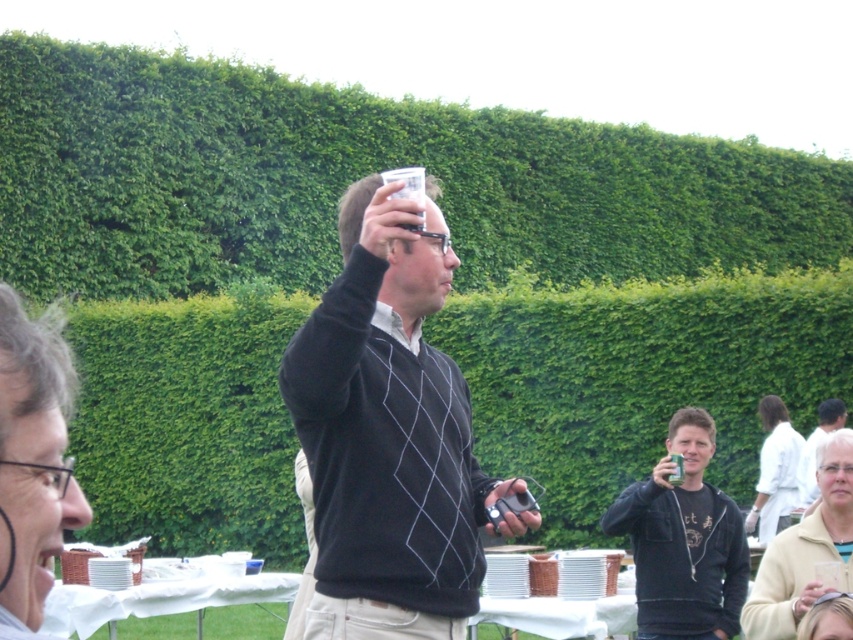
You are a photographer at this event and want to capture both the dark gray sweater at center and the white textured shirt at lower right in the same frame. Since you can only focus on one subject at a time, which one should you choose to ensure the other remains in the background?

You should focus on the dark gray sweater at center because it is closer to the viewer, allowing the white textured shirt at lower right to naturally fall into the background of the photo.

You are taking a photo of the scene and want to focus on both the man holding the glass and the partially visible person. Which of the two points, point 1 at coordinates point (389, 529) or point 2 at coordinates point (24, 506), should you focus on first to ensure both are in focus?

You should focus on point 1 at coordinates point (389, 529) first because it is further away from the camera than point 2 at coordinates point (24, 506), ensuring both will be in focus when focusing on the farther point.

What is the color of the sweater at the point labeled as point (389, 435)?

The point (389, 435) is located on the dark gray sweater at center, so the color is dark gray.